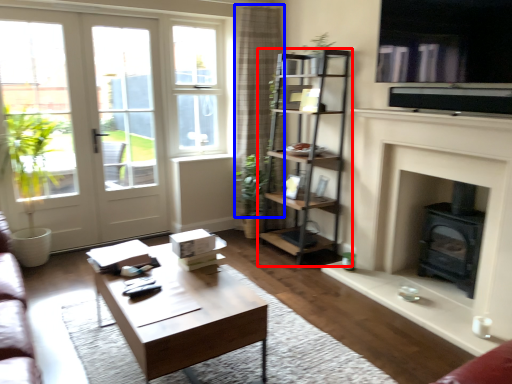
Question: Among these objects, which one is nearest to the camera, shelf (highlighted by a red box) or curtain (highlighted by a blue box)?

Choices:
 (A) shelf
 (B) curtain

Answer: (A)